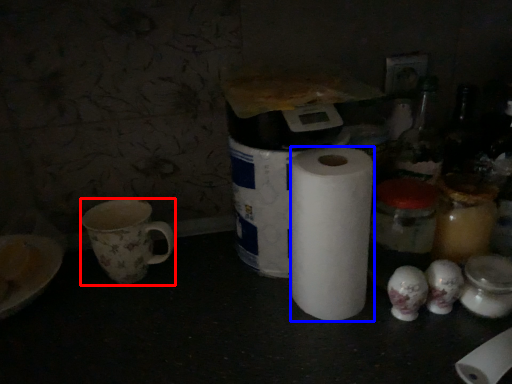
Question: Which point is closer to the camera, coffee cup (highlighted by a red box) or paper towel (highlighted by a blue box)?

Choices:
 (A) coffee cup
 (B) paper towel

Answer: (B)